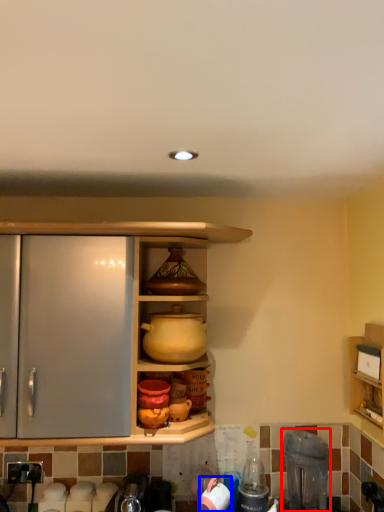
Question: Which of the following is the closest to the observer, appliance (highlighted by a red box) or appliance (highlighted by a blue box)?

Choices:
 (A) appliance
 (B) appliance

Answer: (A)